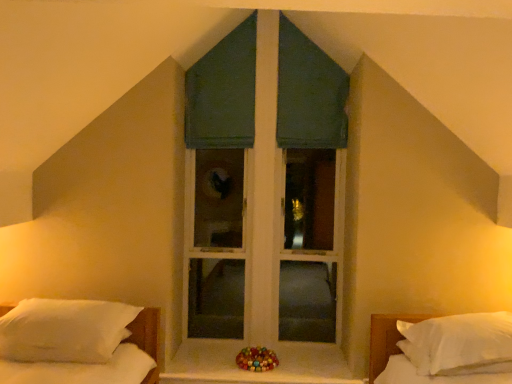
Question: Does green fabric window at center have a lesser height compared to white soft pillow at right, which is counted as the 2th bed, starting from the left?

Choices:
 (A) yes
 (B) no

Answer: (B)

Question: Considering the relative sizes of green fabric window at center and white soft pillow at right, which is counted as the 2th bed, starting from the left, in the image provided, is green fabric window at center wider than white soft pillow at right, which is counted as the 2th bed, starting from the left,?

Choices:
 (A) no
 (B) yes

Answer: (A)

Question: Considering the relative sizes of green fabric window at center and white soft pillow at right, which is counted as the 2th bed, starting from the left, in the image provided, is green fabric window at center smaller than white soft pillow at right, which is counted as the 2th bed, starting from the left,?

Choices:
 (A) yes
 (B) no

Answer: (B)

Question: From the image's perspective, is green fabric window at center beneath white soft pillow at right, the 1th bed in the right-to-left sequence?

Choices:
 (A) yes
 (B) no

Answer: (B)

Question: Is green fabric window at center touching white soft pillow at right, which is counted as the 2th bed, starting from the left?

Choices:
 (A) no
 (B) yes

Answer: (A)

Question: Considering their positions, is white soft pillow at right, which is counted as the 2th bed, starting from the left, located in front of or behind shiny multicolored beads at center?

Choices:
 (A) front
 (B) behind

Answer: (A)

Question: From a real-world perspective, is white soft pillow at right, which is counted as the 2th bed, starting from the left, physically located above or below shiny multicolored beads at center?

Choices:
 (A) above
 (B) below

Answer: (A)

Question: From the image's perspective, is white soft pillow at right, the 1th bed in the right-to-left sequence, located above or below shiny multicolored beads at center?

Choices:
 (A) above
 (B) below

Answer: (A)

Question: Considering the positions of white soft pillow at right, which is counted as the 2th bed, starting from the left, and shiny multicolored beads at center in the image, is white soft pillow at right, which is counted as the 2th bed, starting from the left, taller or shorter than shiny multicolored beads at center?

Choices:
 (A) short
 (B) tall

Answer: (B)

Question: Considering the relative positions of green fabric window at center and white matte window sill at center in the image provided, is green fabric window at center to the left or to the right of white matte window sill at center?

Choices:
 (A) left
 (B) right

Answer: (B)

Question: From the image's perspective, is green fabric window at center located above or below white matte window sill at center?

Choices:
 (A) below
 (B) above

Answer: (B)

Question: Considering the positions of green fabric window at center and white matte window sill at center in the image, is green fabric window at center bigger or smaller than white matte window sill at center?

Choices:
 (A) big
 (B) small

Answer: (A)

Question: Looking at their shapes, would you say green fabric window at center is wider or thinner than white matte window sill at center?

Choices:
 (A) wide
 (B) thin

Answer: (B)

Question: Choose the correct answer: Is green fabric window at center inside white soft pillow at right, which is counted as the 2th bed, starting from the left, or outside it?

Choices:
 (A) inside
 (B) outside

Answer: (B)

Question: Is point (330, 302) positioned closer to the camera than point (463, 345)?

Choices:
 (A) farther
 (B) closer

Answer: (A)